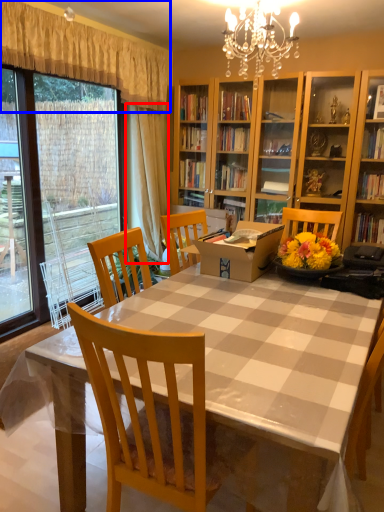
Question: Which point is closer to the camera, curtain (highlighted by a red box) or curtain (highlighted by a blue box)?

Choices:
 (A) curtain
 (B) curtain

Answer: (B)